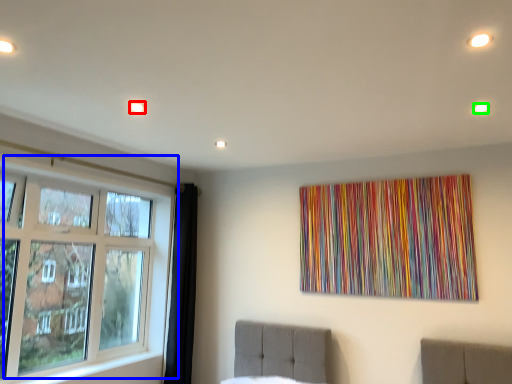
Question: Which object is the farthest from light (highlighted by a red box)? Choose among these: window (highlighted by a blue box) or light (highlighted by a green box).

Choices:
 (A) window
 (B) light

Answer: (B)